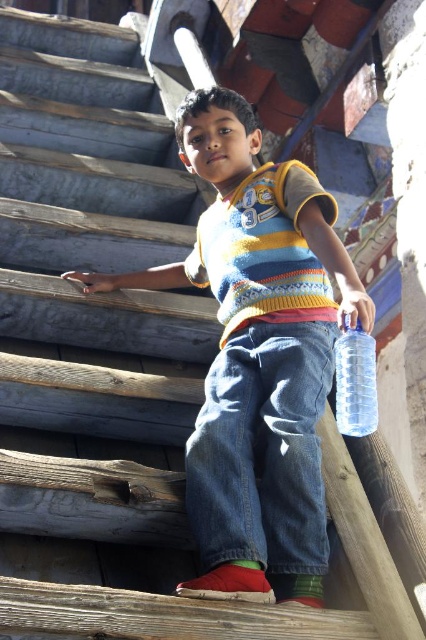
You are an interior designer assessing the placement of the knitted sweater at center in a room. Based on its coordinates, is it positioned closer to the top or bottom of the image?

The knitted sweater at center is located at point (258, 355), which places it closer to the bottom of the image since the y coordinate is 0.606, meaning it is 60.6 percent from the bottom.

The boy is holding a clear plastic bottle at right. Where is the knitted sweater at center in relation to the bottle?

The knitted sweater at center is located above the clear plastic bottle at right.